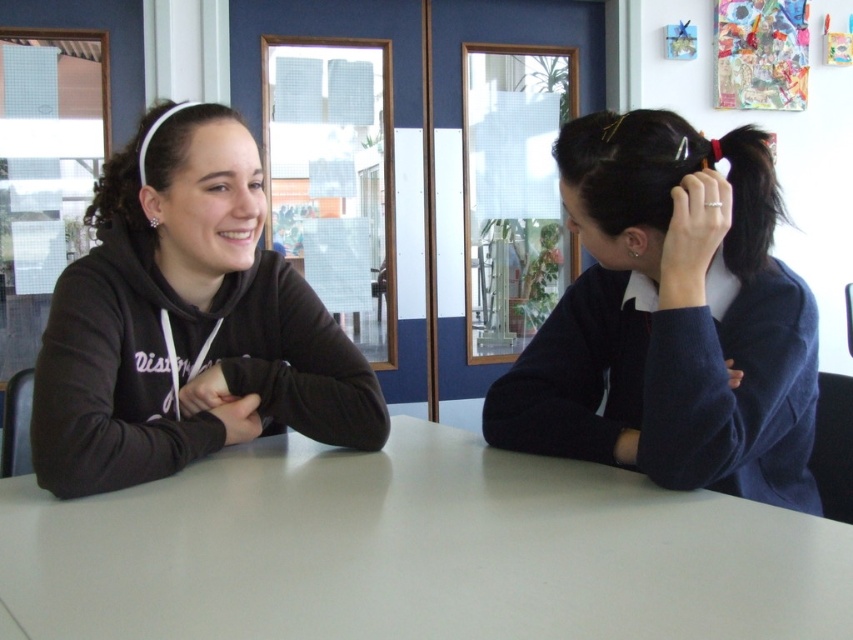
You are standing at a point 33.36 inches away from the camera. You want to reach the point marked as point (102, 637) on the table. Can you estimate whether you can reach it without moving your feet?

The point (102, 637) is 33.36 inches away from the camera. Since you are standing at a point 33.36 inches away from the camera, you are already at the same distance as the point. Therefore, you can likely reach it without moving your feet.

You are a photographer setting up for a group photo. You need to ensure that the white glossy table at center and the dark blue sweater at right are both in focus. The camera you are using has a depth of field that can cover objects within a 10 inch range. Can both objects be in focus at the same time?

The white glossy table at center is 12.18 inches from dark blue sweater at right. Since the distance between them exceeds the camera sensor depth of field range of 10 inches, it is not possible to have both objects in focus simultaneously.

You are sitting at a table in a classroom and want to pass a pencil to the person wearing the dark blue sweater at right. Which direction should you move the pencil from the matte black hoodie at left?

The dark blue sweater at right is positioned on the right side of the matte black hoodie at left, so you should move the pencil to the right from the matte black hoodie at left to reach the dark blue sweater at right.